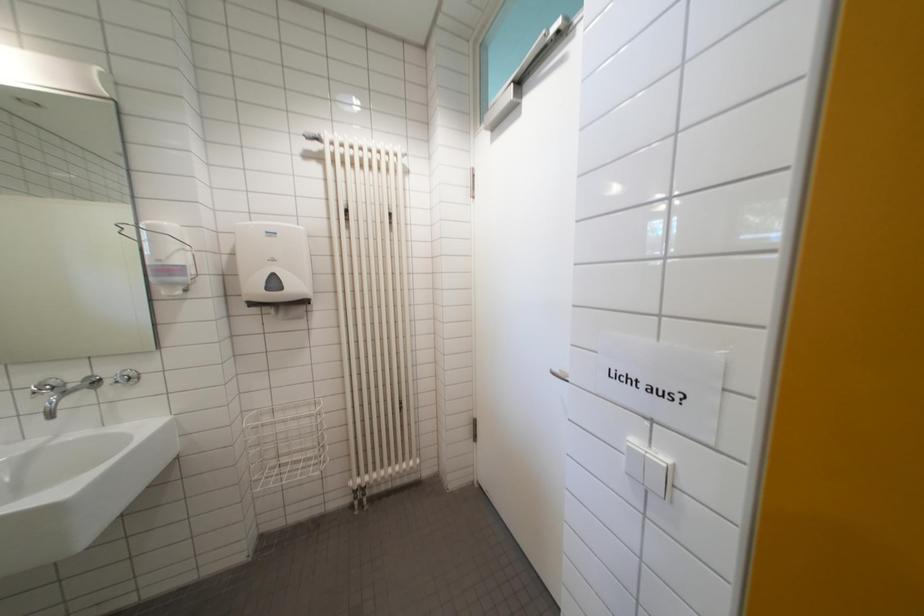
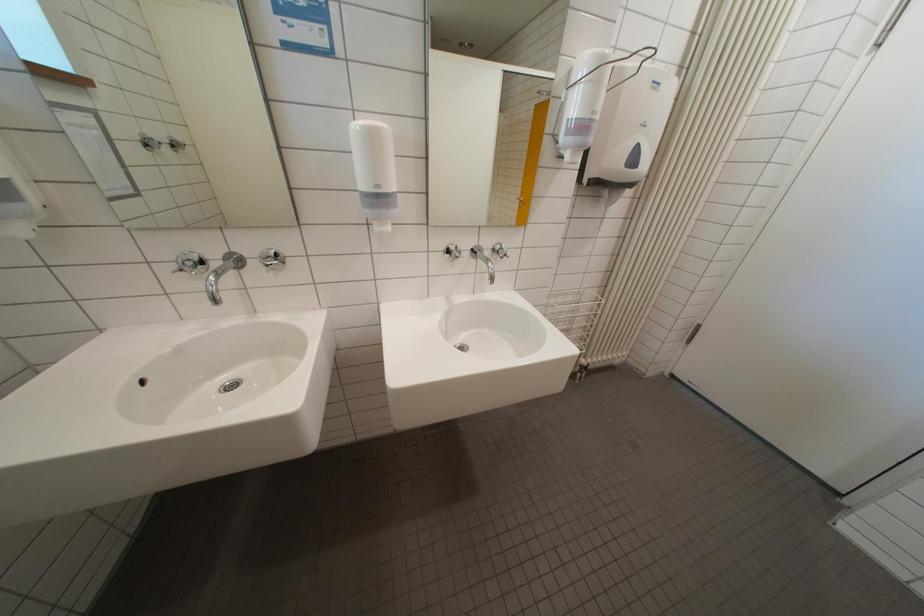
Question: The images are taken continuously from a first-person perspective. In which direction are you moving?

Choices:
 (A) Left
 (B) Right
 (C) Forward
 (D) Backward

Answer: (A)